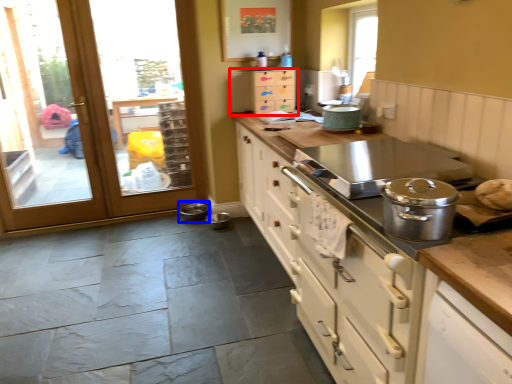
Question: Which of the following is the farthest to the observer, cabinetry (highlighted by a red box) or appliance (highlighted by a blue box)?

Choices:
 (A) cabinetry
 (B) appliance

Answer: (B)